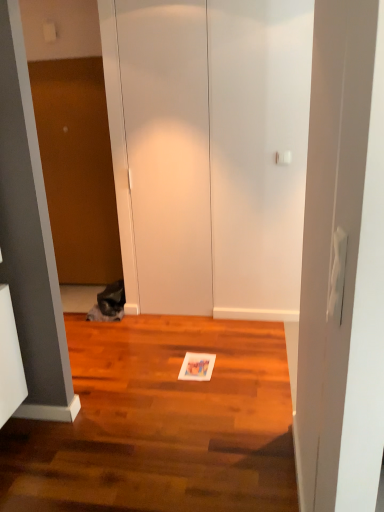
Measure the distance between fuzzy gray cat at left and camera.

The distance of fuzzy gray cat at left from camera is 3.49 meters.

Locate an element on the screen. This screenshot has width=384, height=512. brown matte door at left is located at coordinates coord(77,168).

In order to face white matte door at center, should I rotate leftwards or rightwards?

Turn left by 3.106 degrees to look at white matte door at center.

Where is `fuzzy gray cat at left`? Image resolution: width=384 pixels, height=512 pixels. fuzzy gray cat at left is located at coordinates (109, 303).

Would you say white matte door at center is a long distance from fuzzy gray cat at left?

Indeed, white matte door at center is not near fuzzy gray cat at left.

From the image's perspective, which is below, white matte door at center or fuzzy gray cat at left?

fuzzy gray cat at left, from the image's perspective.

Between point (212, 307) and point (124, 294), which one is positioned behind?

Point (124, 294)

In the scene shown: Which of these two, white matte door at center or brown matte door at left, is smaller?

white matte door at center.

Based on their positions, is white matte door at center located to the left or right of brown matte door at left?

white matte door at center is positioned on brown matte door at left's right side.

Does white matte door at center touch brown matte door at left?

They are not placed beside each other.

In the scene shown: From the image's perspective, is white matte door at center above brown matte door at left?

Actually, white matte door at center appears below brown matte door at left in the image.

From the image's perspective, does fuzzy gray cat at left appear higher than brown matte door at left?

No, from the image's perspective, fuzzy gray cat at left is not over brown matte door at left.

Considering the sizes of objects fuzzy gray cat at left and brown matte door at left in the image provided, who is shorter, fuzzy gray cat at left or brown matte door at left?

fuzzy gray cat at left is shorter.

Image resolution: width=384 pixels, height=512 pixels. I want to click on cat located underneath the brown matte door at left (from a real-world perspective), so pos(109,303).

Based on the photo, can you confirm if brown matte door at left is bigger than shiny brown hardwood floor at center?

Incorrect, brown matte door at left is not larger than shiny brown hardwood floor at center.

From a real-world perspective, between brown matte door at left and shiny brown hardwood floor at center, who is vertically higher?

In real-world perspective, brown matte door at left is above.

From their relative heights in the image, would you say brown matte door at left is taller or shorter than shiny brown hardwood floor at center?

In the image, brown matte door at left appears to be taller than shiny brown hardwood floor at center.

Is brown matte door at left further to camera compared to shiny brown hardwood floor at center?

Yes, it is behind shiny brown hardwood floor at center.

From the picture: Measure the distance between fuzzy gray cat at left and shiny brown hardwood floor at center.

fuzzy gray cat at left and shiny brown hardwood floor at center are 3.94 feet apart.

How many degrees apart are the facing directions of fuzzy gray cat at left and shiny brown hardwood floor at center?

The angular difference between fuzzy gray cat at left and shiny brown hardwood floor at center is 89.6 degrees.

In the scene shown: Does fuzzy gray cat at left appear on the right side of shiny brown hardwood floor at center?

In fact, fuzzy gray cat at left is to the left of shiny brown hardwood floor at center.

Find the location of a particular element. Image resolution: width=384 pixels, height=512 pixels. cat above the shiny brown hardwood floor at center (from the image's perspective) is located at coordinates tap(109, 303).

Considering the positions of point (106, 263) and point (119, 293), is point (106, 263) closer or farther from the camera than point (119, 293)?

Clearly, point (106, 263) is more distant from the camera than point (119, 293).

Which object is more forward, brown matte door at left or fuzzy gray cat at left?

Positioned in front is fuzzy gray cat at left.

Looking at this image, can you see brown matte door at left touching fuzzy gray cat at left?

There is a gap between brown matte door at left and fuzzy gray cat at left.

Which of these two, brown matte door at left or fuzzy gray cat at left, is smaller?

With smaller size is fuzzy gray cat at left.

From a real-world perspective, is shiny brown hardwood floor at center positioned above or below fuzzy gray cat at left?

Clearly, from a real-world perspective, shiny brown hardwood floor at center is below fuzzy gray cat at left.

Does shiny brown hardwood floor at center appear on the left side of fuzzy gray cat at left?

Incorrect, shiny brown hardwood floor at center is not on the left side of fuzzy gray cat at left.

Who is taller, shiny brown hardwood floor at center or fuzzy gray cat at left?

fuzzy gray cat at left is taller.

Find the location of a particular element. cat located below the white matte door at center (from the image's perspective) is located at coordinates (109, 303).

At what (x,y) coordinates should I click in order to perform the action: click on glass door that appears above the brown matte door at left (from a real-world perspective). Please return your answer as a coordinate pair (x, y). This screenshot has height=512, width=384. Looking at the image, I should click on [x=167, y=150].

Considering their positions, is white matte door at center positioned closer to brown matte door at left than fuzzy gray cat at left?

white matte door at center.

When comparing their distances from fuzzy gray cat at left, does brown matte door at left or shiny brown hardwood floor at center seem further?

shiny brown hardwood floor at center lies further to fuzzy gray cat at left than the other object.

Looking at the image, which one is located closer to white matte door at center, shiny brown hardwood floor at center or brown matte door at left?

Based on the image, brown matte door at left appears to be nearer to white matte door at center.

Consider the image. Based on their spatial positions, is brown matte door at left or fuzzy gray cat at left further from shiny brown hardwood floor at center?

brown matte door at left lies further to shiny brown hardwood floor at center than the other object.

When comparing their distances from brown matte door at left, does white matte door at center or shiny brown hardwood floor at center seem closer?

white matte door at center.

Looking at the image, which one is located further to shiny brown hardwood floor at center, white matte door at center or fuzzy gray cat at left?

Among the two, white matte door at center is located further to shiny brown hardwood floor at center.

Which object lies nearer to the anchor point shiny brown hardwood floor at center, brown matte door at left or white matte door at center?

white matte door at center.

Based on their spatial positions, is fuzzy gray cat at left or brown matte door at left further from shiny brown hardwood floor at center?

brown matte door at left lies further to shiny brown hardwood floor at center than the other object.

In order to click on glass door positioned between shiny brown hardwood floor at center and fuzzy gray cat at left from near to far in this screenshot , I will do `click(167, 150)`.

Identify the location of glass door located between shiny brown hardwood floor at center and brown matte door at left in the depth direction. The width and height of the screenshot is (384, 512). (167, 150).

Image resolution: width=384 pixels, height=512 pixels. In order to click on cat between shiny brown hardwood floor at center and brown matte door at left along the z-axis in this screenshot , I will do `click(109, 303)`.

Locate an element on the screen. The width and height of the screenshot is (384, 512). glass door between brown matte door at left and fuzzy gray cat at left from top to bottom is located at coordinates (167, 150).